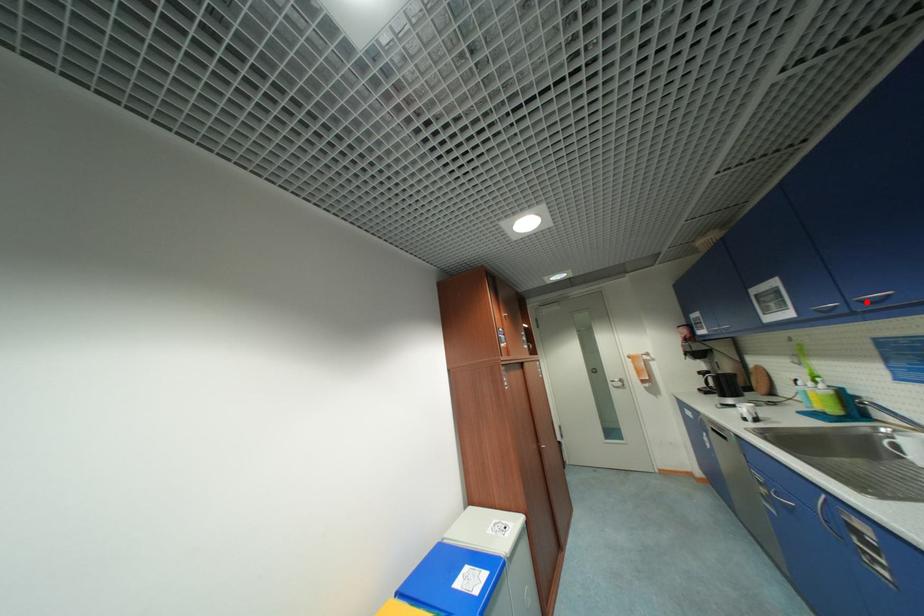
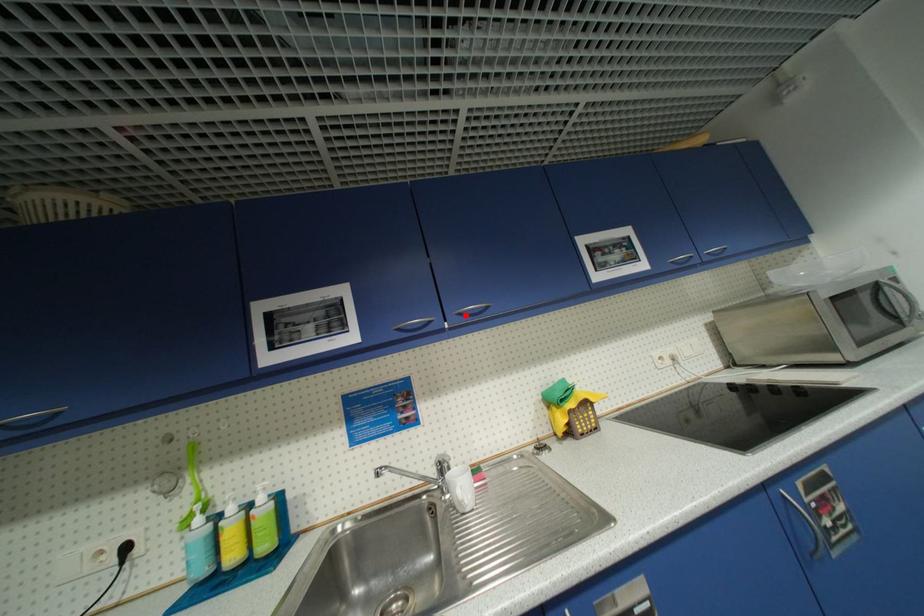
I am providing you with two images of the same scene from different viewpoints. A red point is marked on the first image and another point is marked on the second image. Does the point marked in image1 correspond to the same location as the one in image2?

Yes